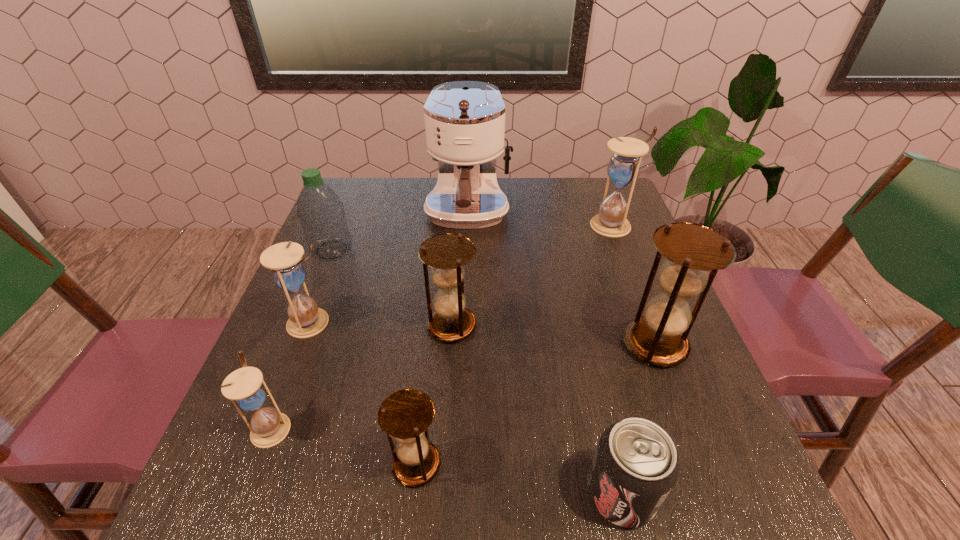
Identify the location of vacant area situated on the left of the third object from right to left. This screenshot has height=540, width=960. (541, 493).

Where is `coffee maker at the far edge`? coffee maker at the far edge is located at coordinates (464, 120).

At what (x,y) coordinates should I click in order to perform the action: click on hourglass situated at the far edge. Please return your answer as a coordinate pair (x, y). The height and width of the screenshot is (540, 960). Looking at the image, I should click on (623, 168).

Where is `hourglass that is positioned at the near edge`? The width and height of the screenshot is (960, 540). hourglass that is positioned at the near edge is located at coordinates (405, 415).

At what (x,y) coordinates should I click in order to perform the action: click on soda can at the near edge. Please return your answer as a coordinate pair (x, y). The image size is (960, 540). Looking at the image, I should click on (635, 466).

Find the location of `water bottle present at the left edge`. water bottle present at the left edge is located at coordinates (320, 211).

This screenshot has height=540, width=960. Identify the location of soda can at the right edge. (635, 466).

This screenshot has height=540, width=960. Identify the location of object that is positioned at the far right corner. (623, 168).

What are the coordinates of `object present at the near right corner` in the screenshot? It's located at (635, 466).

Locate an element on the screen. The width and height of the screenshot is (960, 540). blank space at the far edge is located at coordinates (393, 192).